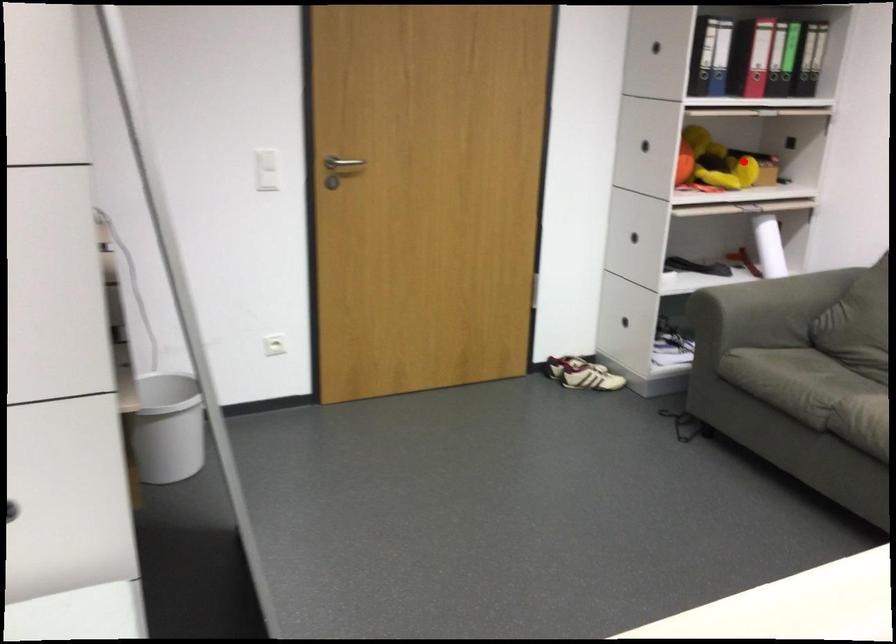
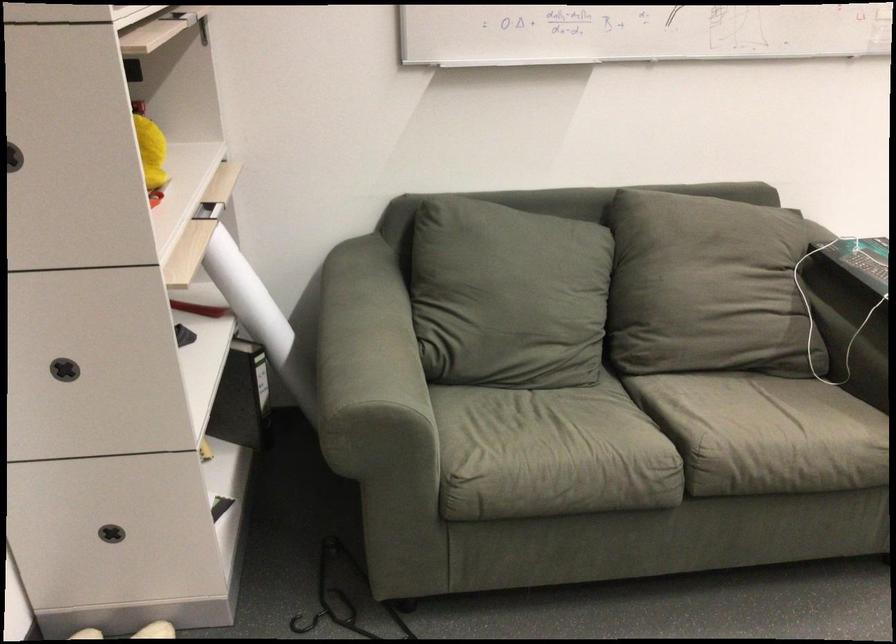
Locate, in the second image, the point that corresponds to the highlighted location in the first image.

(151, 152)